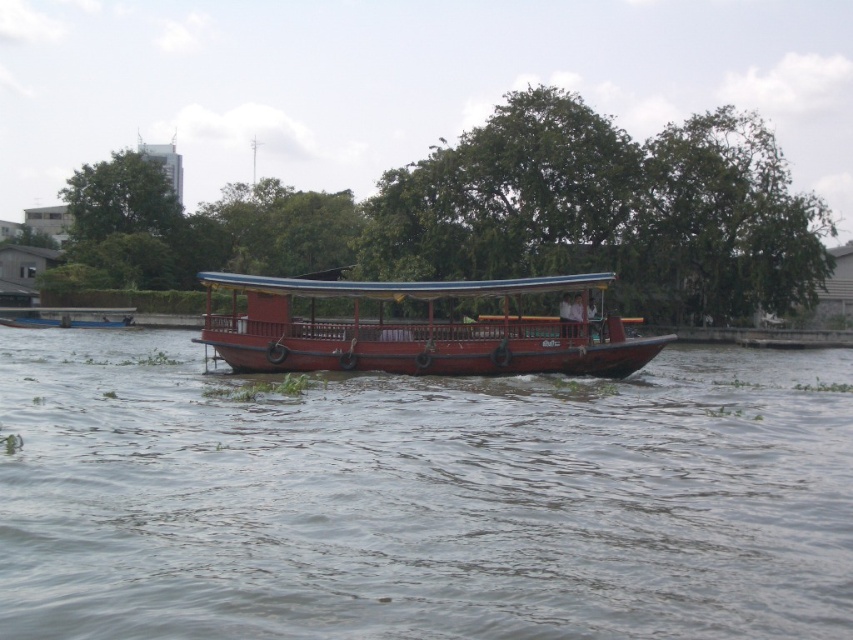
You are standing on the wooden boat at center and want to reach the green leafy tree at center. Which direction should you go to get closer to the tree?

The green leafy tree at center is already at the same position as the wooden boat at center, so you don not need to move in any direction to get closer.

You are a passenger on the wooden boat at center and want to jump into the brown wooden river at center. Can you safely jump into the river from the boat?

The brown wooden river at center has a smaller size compared to wooden boat at center, meaning the river is narrower than the boat. Since the boat is larger than the river, jumping into the river might be unsafe as there may not be enough space. Please check the surroundings for a safer entry point.

You are standing on the wooden boat at center and want to step onto the brown wooden river at center. Is this possible?

The brown wooden river at center is located below the wooden boat at center, so stepping onto it from the boat would require jumping down as it is positioned lower.